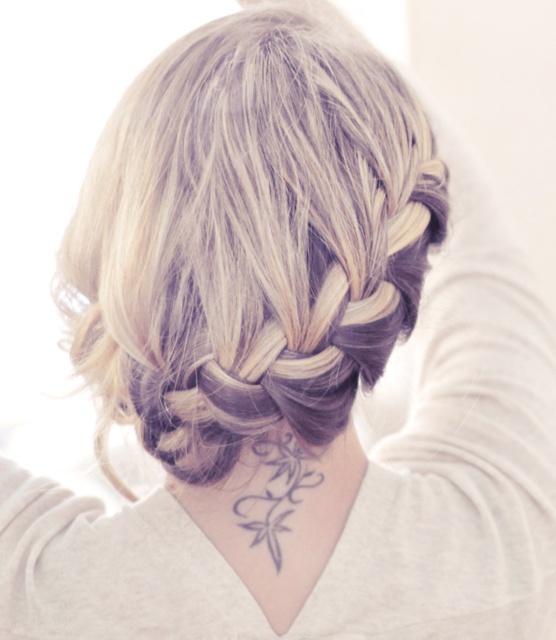
You are a photographer adjusting your camera settings to capture the intricate details of the hair and tattoo in the image. You notice two points on the person, namely point (191, 515) and point (262, 486). Which point should you focus on first to ensure both points remain in focus?

Point (191, 515) is further to the camera than point (262, 486). To ensure both points remain in focus, you should focus on the closer point, which is point (262, 486), as focusing on the closer object maximizes the depth of field for both points.

From the picture: You are a tattoo artist reviewing the back of a client. You notice the black tattoo at center and the gray ink floral design at center back. Which tattoo do you think is bigger?

The black tattoo at center is larger in size than the gray ink floral design at center back.